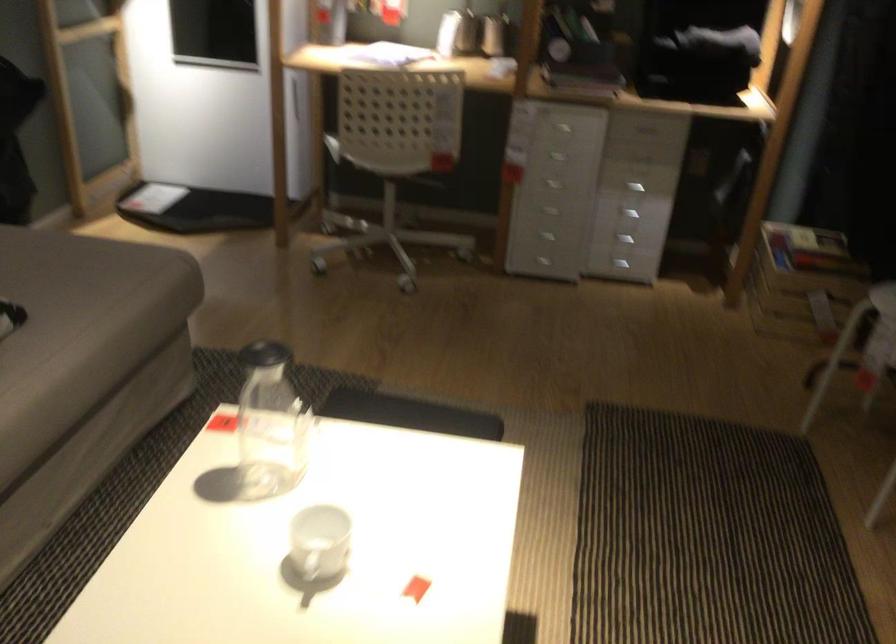
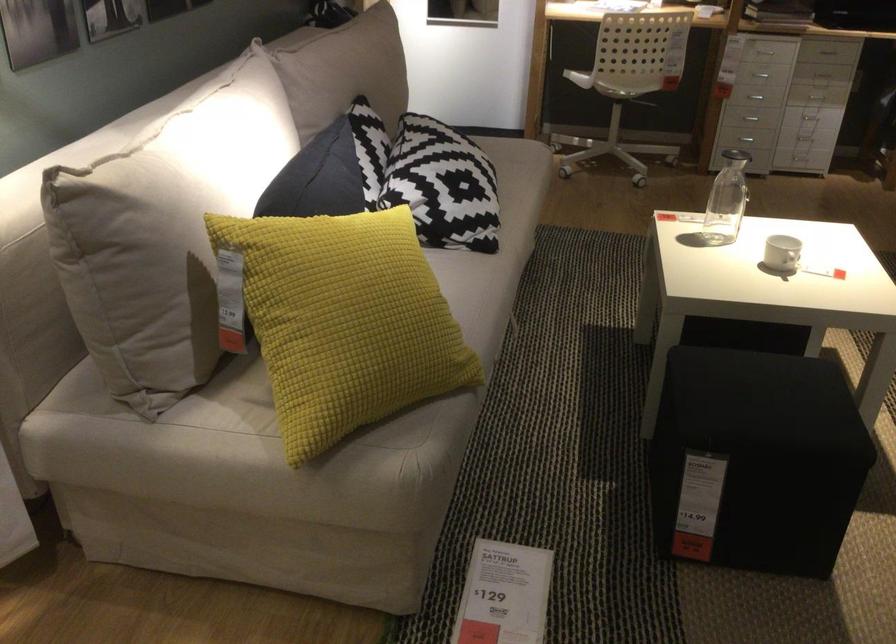
In the second image, find the point that corresponds to pixel 375 167 in the first image.

(627, 80)